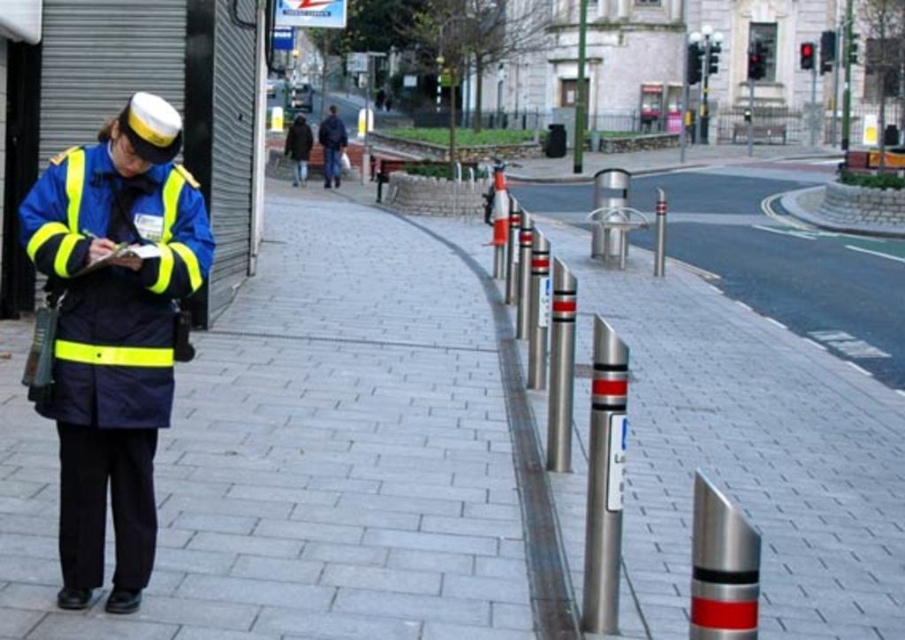
Does high-visibility fabric uniform at left have a larger size compared to dark brown leather jacket at center?

No.

Between high-visibility fabric uniform at left and dark brown leather jacket at center, which one has less height?

high-visibility fabric uniform at left

This screenshot has width=905, height=640. Describe the element at coordinates (113, 332) in the screenshot. I see `high-visibility fabric uniform at left` at that location.

Where is `high-visibility fabric uniform at left`? The image size is (905, 640). high-visibility fabric uniform at left is located at coordinates (113, 332).

Between dark blue jacket at center and polished metal pole at upper right, which one has less height?

With less height is polished metal pole at upper right.

Consider the image. Can you confirm if dark blue jacket at center is wider than polished metal pole at upper right?

Incorrect, dark blue jacket at center's width does not surpass polished metal pole at upper right's.

Which is in front, point (331, 184) or point (845, 35)?

Point (331, 184) is more forward.

The width and height of the screenshot is (905, 640). I want to click on dark blue jacket at center, so click(331, 147).

Can you confirm if high-visibility fabric uniform at left is smaller than silver metallic pole at center?

Yes.

Is point (100, 336) more distant than point (580, 12)?

That is False.

I want to click on high-visibility fabric uniform at left, so click(x=113, y=332).